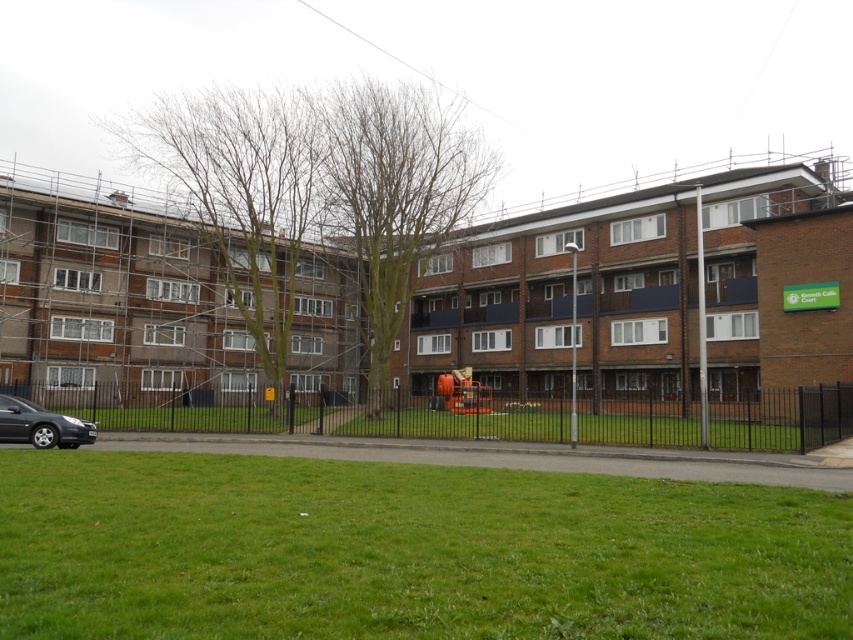
You are a delivery person trying to park your vehicle in the residential area. You see the green grass at center and the matte black car at lower left. Which area is closer to you where you can park?

The green grass at center is further to the viewer than the matte black car at lower left, so the matte black car at lower left is closer and a better option for parking.

You are a gardener who needs to mow the lawn in the residential area. You have a lawnmower that can only cut grass shorter than 5 cm. You see the green grass at lower center and the green grass at center. Which area should you mow first to ensure the grass doesn not grow too long?

The green grass at center should be mowed first because it is taller than the green grass at lower center, which is shorter. By addressing the taller grass first, you can prevent it from growing too long while the shorter grass can be mowed later.

You are a delivery person trying to park your 1.8 meters tall delivery cart between the green grass at center and the matte black car at lower left. Based on the scene, can your cart fit vertically between them?

The green grass at center is taller than the matte black car at lower left. Since the grass is taller, the vertical space between them would be sufficient for your 1.8 meters tall delivery cart to fit.